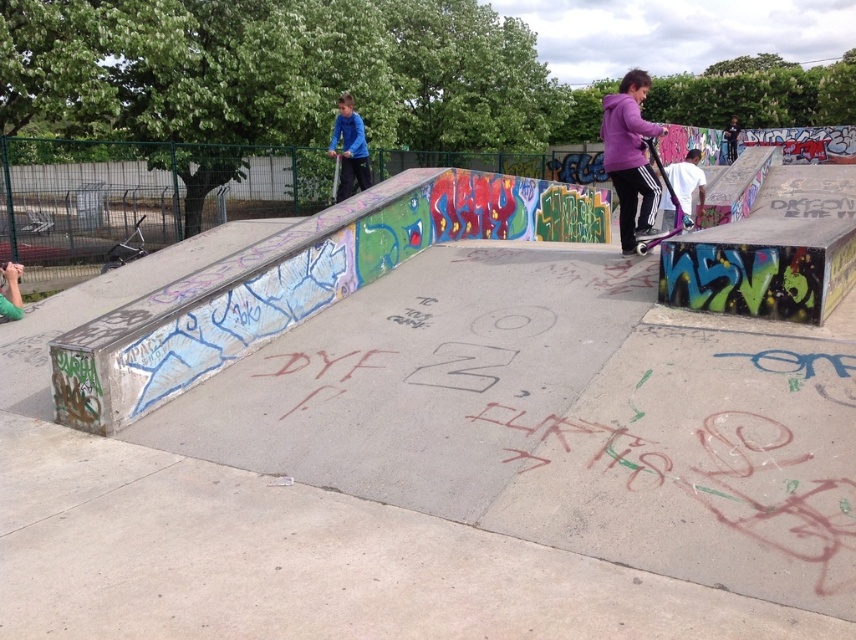
You are a skatepark attendant and need to place two skateboards on a narrow shelf that can only hold items up to 25 cm in width. You have a metallic blue skateboard at center and a metallic purple skateboard at center. Which skateboard can fit on the shelf if the shelf width matches the narrower skateboard?

The metallic blue skateboard at center has a lesser width compared to the metallic purple skateboard at center, so the metallic blue skateboard at center can fit on the shelf.

You are a photographer positioned at the entrance of the skatepark. You want to capture a photo that includes both the blue matte shirt at upper center and the metallic purple skateboard at center. Which object should you adjust your camera to focus on first to ensure both are in frame?

The blue matte shirt at upper center is to the right of the metallic purple skateboard at center. To include both in the frame, focus on the metallic purple skateboard at center first, as it is centrally located, then adjust to include the blue matte shirt at upper center to the right.